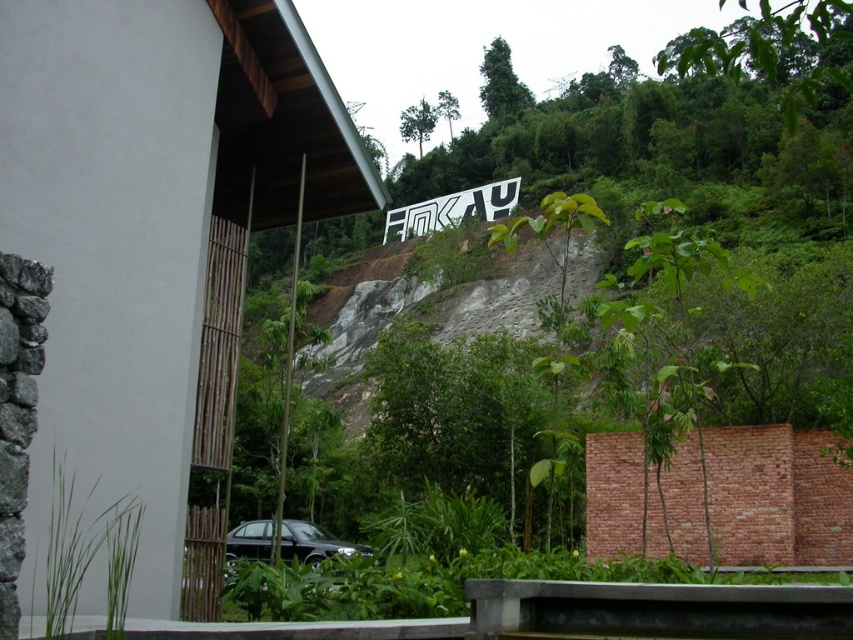
Between point (505, 212) and point (286, 550), which one is positioned in front?

Point (286, 550) is more forward.

You are a GUI agent. You are given a task and a screenshot of the screen. Output one action in this format:
    pyautogui.click(x=<x>, y=<y>)
    Task: Click on the white metallic sign at upper center
    
    Given the screenshot: What is the action you would take?
    [x=451, y=211]